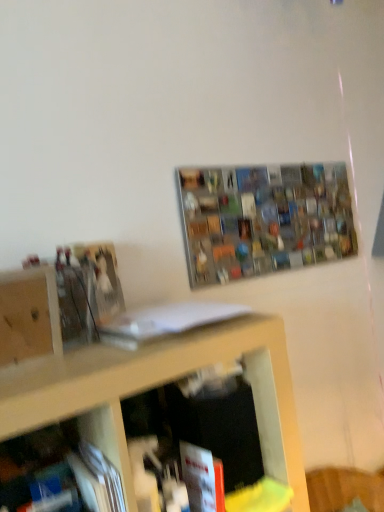
Question: Is wooden cabinet at left located within white matte book at center, the first book in the top-to-bottom sequence?

Choices:
 (A) yes
 (B) no

Answer: (B)

Question: Does white matte book at center, arranged as the second book when ordered from the bottom, have a larger size compared to wooden cabinet at left?

Choices:
 (A) yes
 (B) no

Answer: (B)

Question: Is white matte book at center, the first book in the top-to-bottom sequence, turned away from wooden cabinet at left?

Choices:
 (A) no
 (B) yes

Answer: (A)

Question: Is white matte book at center, arranged as the second book when ordered from the bottom, positioned behind wooden cabinet at left?

Choices:
 (A) yes
 (B) no

Answer: (A)

Question: Does white matte book at center, the first book in the top-to-bottom sequence, have a lesser height compared to wooden cabinet at left?

Choices:
 (A) no
 (B) yes

Answer: (B)

Question: From a real-world perspective, is white matte book at center, arranged as the second book when ordered from the bottom, beneath wooden cabinet at left?

Choices:
 (A) no
 (B) yes

Answer: (B)

Question: Is red matte book at lower center, the second book viewed from the top, facing away from wooden cabinet at left?

Choices:
 (A) yes
 (B) no

Answer: (B)

Question: Can you confirm if red matte book at lower center, the second book viewed from the top, is shorter than wooden cabinet at left?

Choices:
 (A) yes
 (B) no

Answer: (A)

Question: Considering the relative positions of red matte book at lower center, the second book viewed from the top, and wooden cabinet at left in the image provided, is red matte book at lower center, the second book viewed from the top, to the right of wooden cabinet at left from the viewer's perspective?

Choices:
 (A) yes
 (B) no

Answer: (A)

Question: Is wooden cabinet at left located within red matte book at lower center, which ranks as the 1th book in bottom-to-top order?

Choices:
 (A) yes
 (B) no

Answer: (B)

Question: Can you confirm if red matte book at lower center, the second book viewed from the top, is taller than wooden cabinet at left?

Choices:
 (A) yes
 (B) no

Answer: (B)

Question: Does red matte book at lower center, which ranks as the 1th book in bottom-to-top order, lie behind wooden cabinet at left?

Choices:
 (A) no
 (B) yes

Answer: (B)

Question: Is wooden cabinet at left far away from metallic grid at upper center?

Choices:
 (A) no
 (B) yes

Answer: (A)